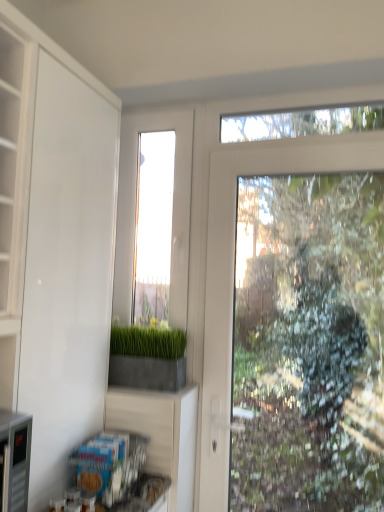
At what (x,y) coordinates should I click in order to perform the action: click on white matte cabinet at left. Please return your answer as a coordinate pair (x, y). The width and height of the screenshot is (384, 512). Looking at the image, I should click on pyautogui.click(x=55, y=241).

Is concrete planter at center surrounding clear glass window at center?

Definitely not — clear glass window at center is not inside concrete planter at center.

Consider the image. Which object is positioned more to the left, concrete planter at center or clear glass window at center?

Positioned to the left is concrete planter at center.

Who is smaller, concrete planter at center or clear glass window at center?

concrete planter at center.

What's the angular difference between concrete planter at center and clear glass window at center's facing directions?

1.73 degrees.

Looking at the image, does white matte cabinet at left seem bigger or smaller compared to concrete planter at center?

In the image, white matte cabinet at left appears to be larger than concrete planter at center.

Is white matte cabinet at left to the left of concrete planter at center from the viewer's perspective?

Correct, you'll find white matte cabinet at left to the left of concrete planter at center.

From the image's perspective, which one is positioned lower, white matte cabinet at left or concrete planter at center?

concrete planter at center, from the image's perspective.

From a real-world perspective, which object stands above the other?

In real-world perspective, white matte cabinet at left is above.

How different are the orientations of clear glass window at center and white matte cabinet at left in degrees?

clear glass window at center and white matte cabinet at left are facing 91.4 degrees away from each other.

Looking at this image, considering the relative sizes of clear glass window at center and white matte cabinet at left in the image provided, is clear glass window at center shorter than white matte cabinet at left?

Yes, clear glass window at center is shorter than white matte cabinet at left.

Is clear glass window at center in contact with white matte cabinet at left?

No, clear glass window at center is not in contact with white matte cabinet at left.

Is clear glass window at center outside of white matte cabinet at left?

Yes, clear glass window at center is outside of white matte cabinet at left.

In order to click on cabinetry in front of the clear glass window at center in this screenshot , I will do `click(55, 241)`.

Does point (73, 244) lie in front of point (127, 239)?

That is True.

Is clear glass window at center located within white matte cabinet at left?

No, clear glass window at center is not surrounded by white matte cabinet at left.

What's the angular difference between white matte cabinet at left and clear glass window at center's facing directions?

The angular difference between white matte cabinet at left and clear glass window at center is 91.4 degrees.

Is clear glass window at center oriented away from concrete planter at center?

No, clear glass window at center's orientation is not away from concrete planter at center.

Between point (124, 123) and point (122, 334), which one is positioned in front?

The point (122, 334) is more forward.

How much distance is there between clear glass window at center and concrete planter at center?

A distance of 30.03 centimeters exists between clear glass window at center and concrete planter at center.

Find the location of a particular element. The height and width of the screenshot is (512, 384). houseplant that is below the clear glass window at center (from the image's perspective) is located at coordinates (147, 358).

Considering the relative sizes of concrete planter at center and white matte cabinet at left in the image provided, is concrete planter at center smaller than white matte cabinet at left?

Yes, concrete planter at center is smaller than white matte cabinet at left.

Would you say concrete planter at center is inside or outside white matte cabinet at left?

concrete planter at center cannot be found inside white matte cabinet at left.

Is concrete planter at center aimed at white matte cabinet at left?

No, concrete planter at center is not oriented towards white matte cabinet at left.

Is concrete planter at center wider than white matte cabinet at left?

No.

Where is `window lying on the right of concrete planter at center`? The width and height of the screenshot is (384, 512). window lying on the right of concrete planter at center is located at coordinates 172,212.

Where is `cabinetry that is above the concrete planter at center (from the image's perspective)`? The image size is (384, 512). cabinetry that is above the concrete planter at center (from the image's perspective) is located at coordinates (55, 241).

Considering their positions, is clear glass window at center positioned closer to white matte cabinet at left than concrete planter at center?

The object closer to white matte cabinet at left is concrete planter at center.

Considering their positions, is clear glass window at center positioned closer to concrete planter at center than white matte cabinet at left?

Among the two, clear glass window at center is located nearer to concrete planter at center.

Considering their positions, is white matte cabinet at left positioned further to concrete planter at center than clear glass window at center?

white matte cabinet at left.

Estimate the real-world distances between objects in this image. Which object is closer to clear glass window at center, concrete planter at center or white matte cabinet at left?

concrete planter at center lies closer to clear glass window at center than the other object.

Looking at the image, which one is located closer to white matte cabinet at left, concrete planter at center or clear glass window at center?

Based on the image, concrete planter at center appears to be nearer to white matte cabinet at left.

Based on their spatial positions, is white matte cabinet at left or concrete planter at center further from clear glass window at center?

Among the two, white matte cabinet at left is located further to clear glass window at center.

Where is `houseplant between white matte cabinet at left and clear glass window at center from front to back`? houseplant between white matte cabinet at left and clear glass window at center from front to back is located at coordinates (147, 358).